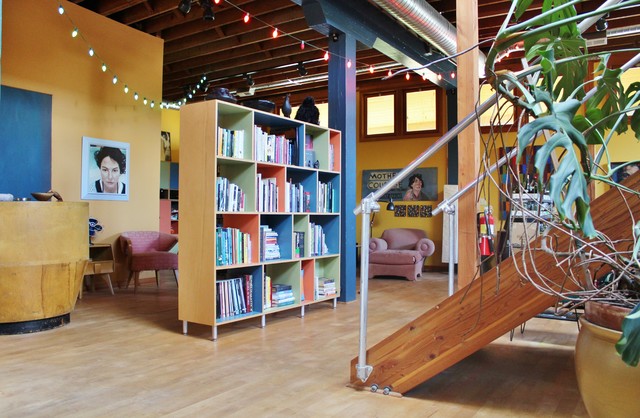
This screenshot has width=640, height=418. What are the coordinates of `fire extinguisher` in the screenshot? It's located at tap(483, 234).